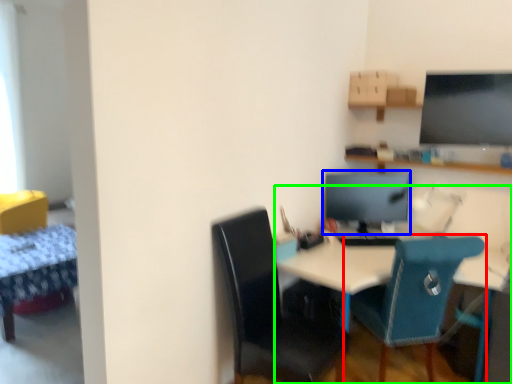
Question: Which object is positioned closest to chair (highlighted by a red box)? Select from computer monitor (highlighted by a blue box) and desk (highlighted by a green box).

Choices:
 (A) computer monitor
 (B) desk

Answer: (B)